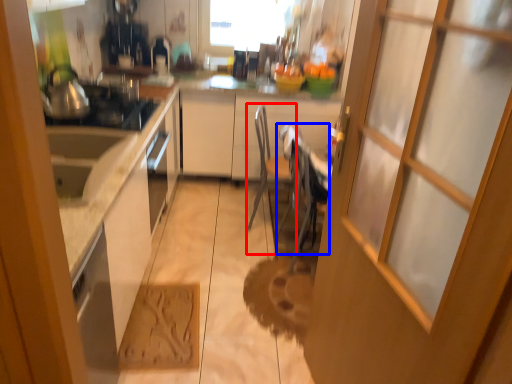
Question: Which of the following is the farthest to the observer, chair (highlighted by a red box) or chair (highlighted by a blue box)?

Choices:
 (A) chair
 (B) chair

Answer: (A)